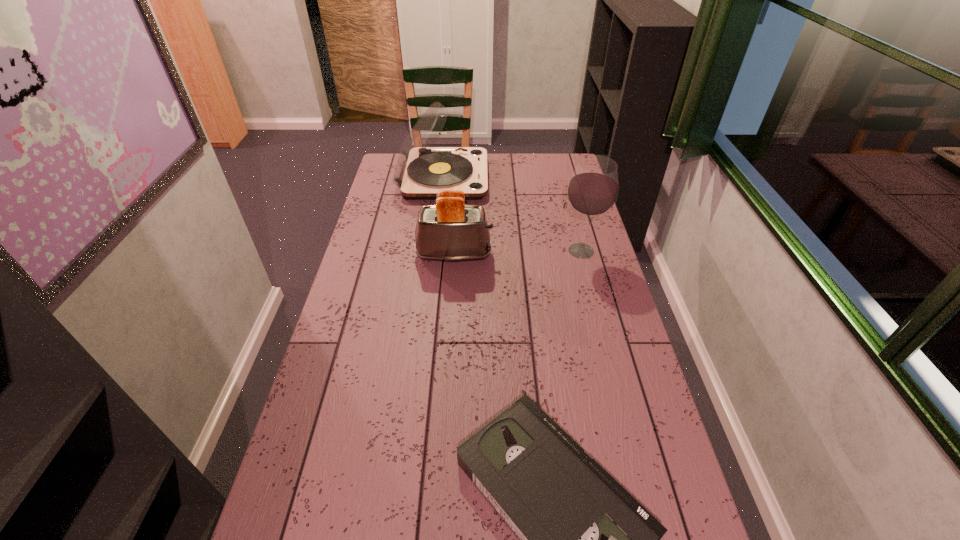
Locate which object ranks third in proximity to the alcohol. Please provide its 2D coordinates. Your answer should be formatted as a tuple, i.e. [(x, y)], where the tuple contains the x and y coordinates of a point satisfying the conditions above.

[(583, 539)]

You are a GUI agent. You are given a task and a screenshot of the screen. Output one action in this format:
    pyautogui.click(x=<x>, y=<y>)
    Task: Click on the vacant region that satisfies the following two spatial constraints: 1. with the tonearm facing the front of the farthest object; 2. on the right side of the alcohol
    
    Given the screenshot: What is the action you would take?
    pyautogui.click(x=434, y=251)

This screenshot has width=960, height=540. In order to click on free space that satisfies the following two spatial constraints: 1. with the tonearm facing the front of the alcohol; 2. on the left side of the farthest object in this screenshot , I will do `click(434, 251)`.

Find the location of a particular element. blank space that satisfies the following two spatial constraints: 1. with the tonearm facing the front of the alcohol; 2. on the right side of the farthest object is located at coordinates (434, 251).

The width and height of the screenshot is (960, 540). I want to click on vacant space that satisfies the following two spatial constraints: 1. with the tonearm facing the front of the alcohol; 2. on the right side of the record player, so click(434, 251).